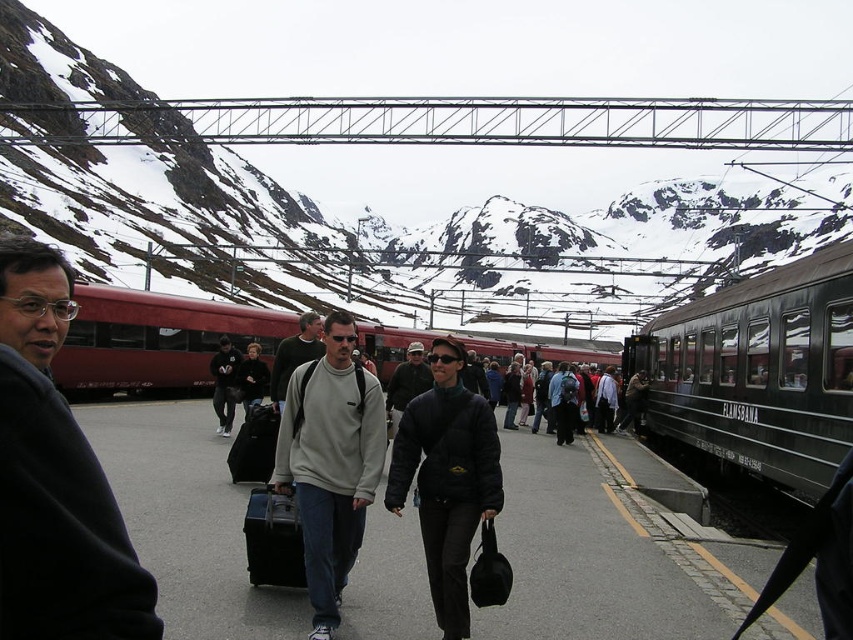
Who is lower down, black metal train at right or dark gray jacket at center?

black metal train at right

Does black metal train at right appear on the left side of dark gray jacket at center?

Incorrect, black metal train at right is not on the left side of dark gray jacket at center.

Does point (676, 323) come behind point (397, 420)?

Yes, point (676, 323) is behind point (397, 420).

Where is `black metal train at right`? black metal train at right is located at coordinates (758, 372).

Can you confirm if light gray sweatshirt at center is wider than matte black suitcase at center?

Correct, the width of light gray sweatshirt at center exceeds that of matte black suitcase at center.

Can you confirm if light gray sweatshirt at center is positioned below matte black suitcase at center?

Actually, light gray sweatshirt at center is above matte black suitcase at center.

Is point (310, 400) in front of point (279, 512)?

No, it is behind (279, 512).

The image size is (853, 640). I want to click on light gray sweatshirt at center, so click(x=329, y=461).

Which is below, snowy rock at upper center or black metal train at right?

black metal train at right is lower down.

Measure the distance between snowy rock at upper center and camera.

A distance of 85.51 meters exists between snowy rock at upper center and camera.

Is point (792, 67) positioned before point (850, 296)?

No, (792, 67) is further to viewer.

Image resolution: width=853 pixels, height=640 pixels. I want to click on snowy rock at upper center, so click(x=428, y=150).